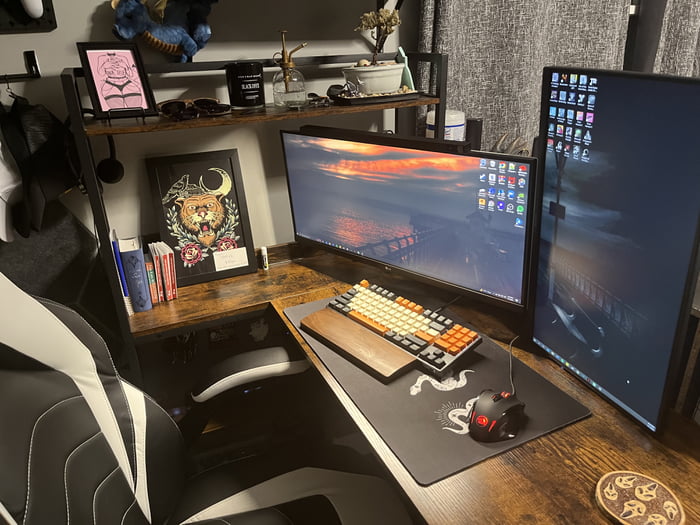
Where is `desktop mat`? This screenshot has height=525, width=700. desktop mat is located at coordinates (391, 411).